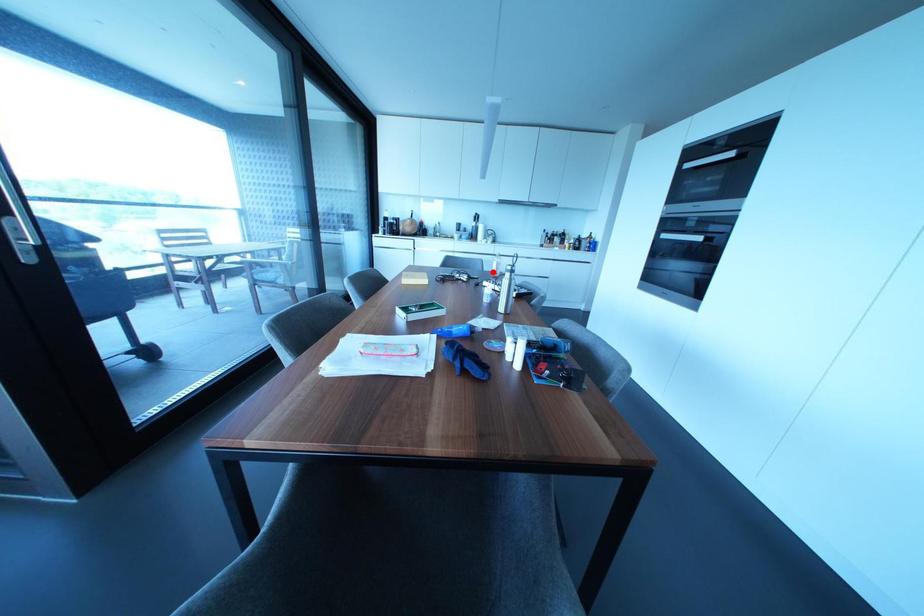
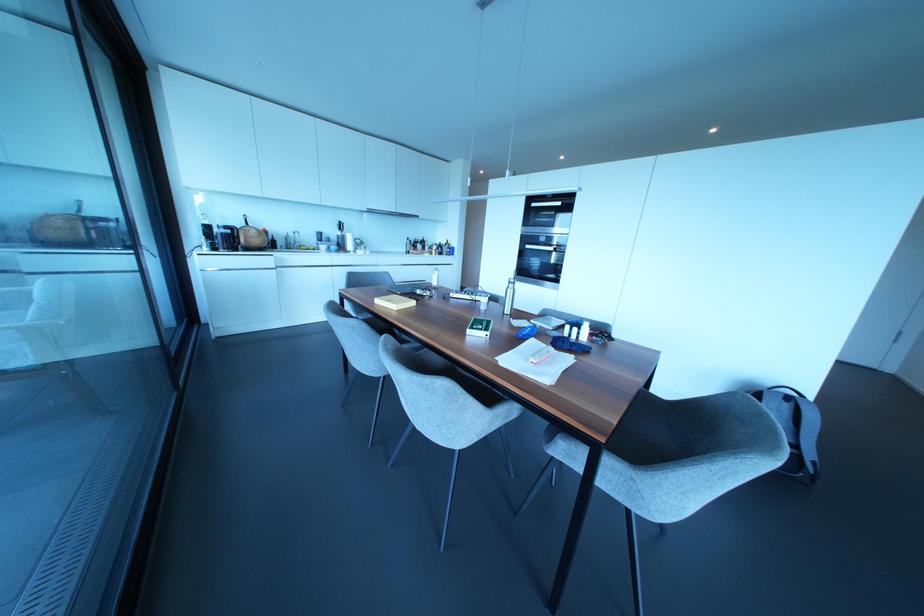
Find the pixel in the second image that matches the highlighted location in the first image.

(434, 283)